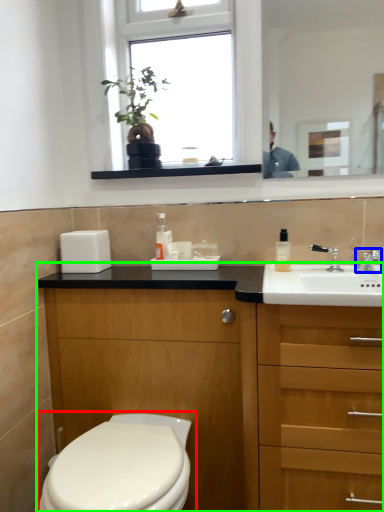
Question: Which object is positioned closest to toilet (highlighted by a red box)? Select from tap (highlighted by a blue box) and bathroom cabinet (highlighted by a green box).

Choices:
 (A) tap
 (B) bathroom cabinet

Answer: (B)